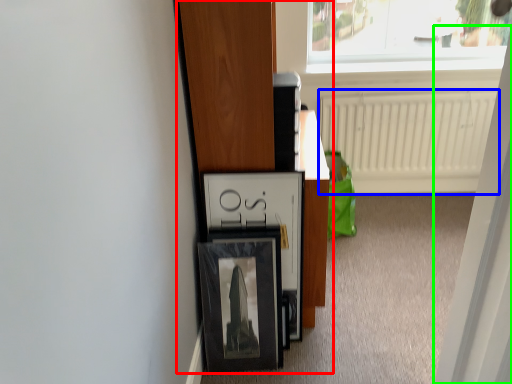
Question: Which object is the closest to the furniture (highlighted by a red box)? Choose among these: radiator (highlighted by a blue box) or screen door (highlighted by a green box).

Choices:
 (A) radiator
 (B) screen door

Answer: (B)